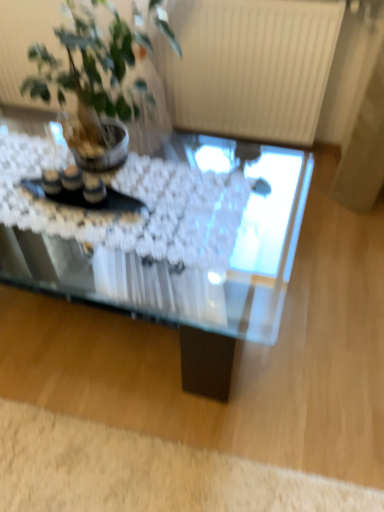
Question: Is transparent glass coffee table at center wider or thinner than green leafy plant at upper left?

Choices:
 (A) wide
 (B) thin

Answer: (A)

Question: Is point (241, 251) positioned closer to the camera than point (96, 29)?

Choices:
 (A) farther
 (B) closer

Answer: (A)

Question: Which is nearer to the green leafy plant at upper left?

Choices:
 (A) white fluffy rug at lower left
 (B) transparent glass coffee table at center

Answer: (B)

Question: Based on their relative distances, which object is nearer to the green leafy plant at upper left?

Choices:
 (A) transparent glass coffee table at center
 (B) white fluffy rug at lower left

Answer: (A)